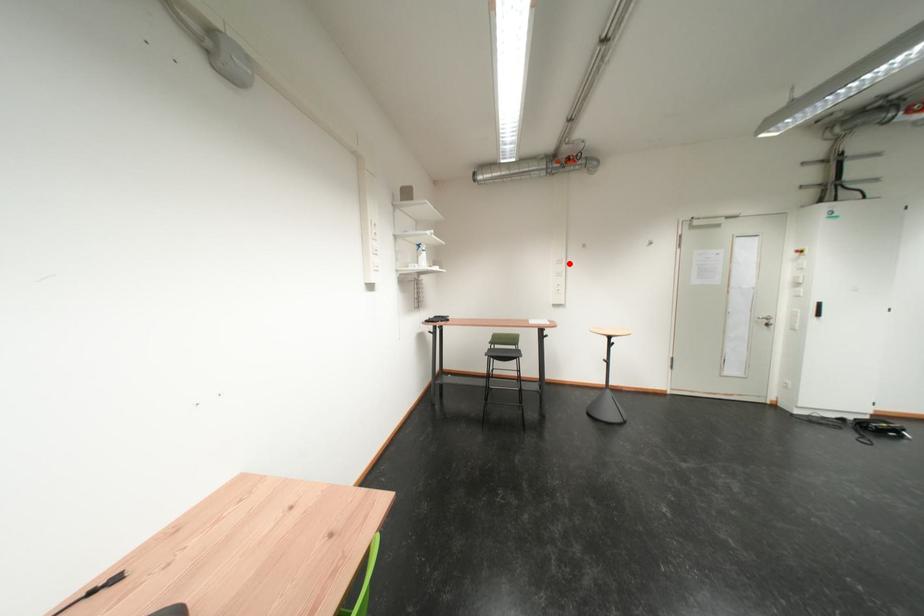
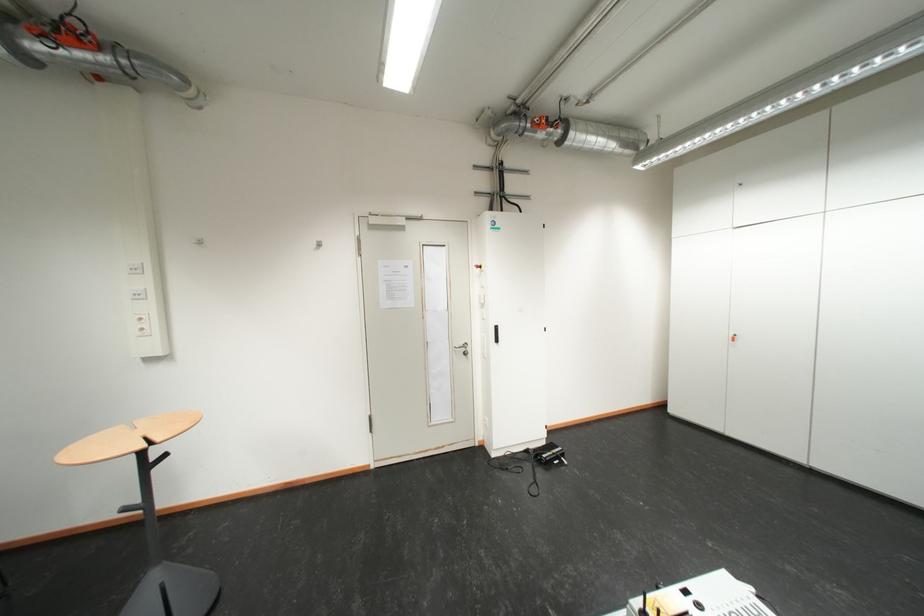
The point at the highlighted location is marked in the first image. Where is the corresponding point in the second image?

(144, 272)